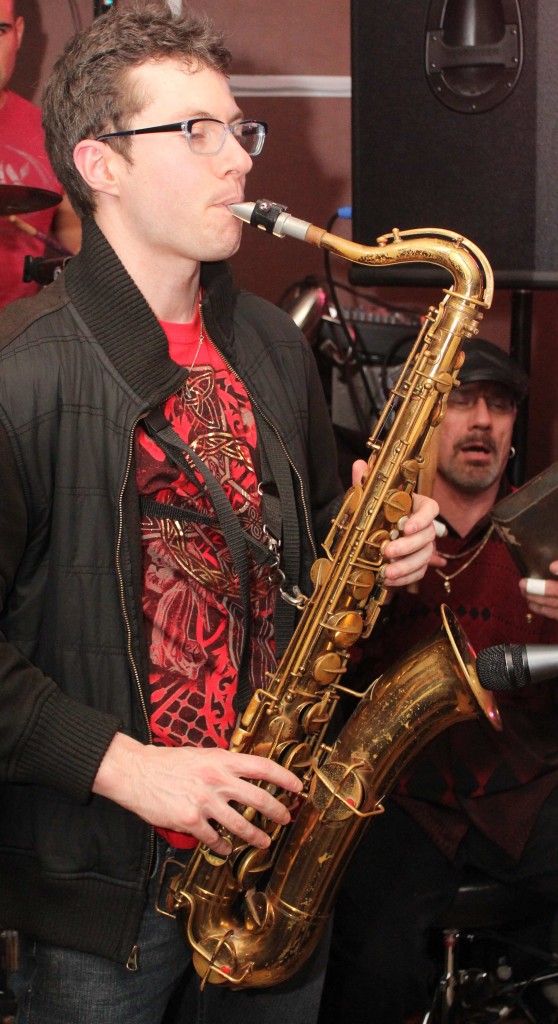
Find the location of a particular element. The width and height of the screenshot is (558, 1024). brown wall is located at coordinates (300, 42).